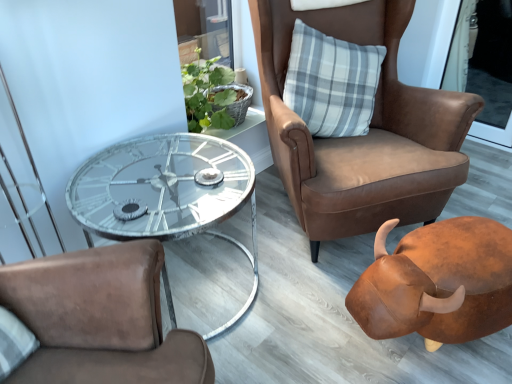
Question: In the image, is brown leather chair at upper right positioned in front of or behind gray plaid pillow at upper right?

Choices:
 (A) behind
 (B) front

Answer: (B)

Question: Is brown leather chair at upper right inside the boundaries of gray plaid pillow at upper right, or outside?

Choices:
 (A) inside
 (B) outside

Answer: (B)

Question: Which object is the farthest from the metallic glass coffee table at center?

Choices:
 (A) transparent plastic screen door at upper right
 (B) brown leather piggy bank at lower right
 (C) brown leather chair at upper right
 (D) gray plaid pillow at upper right

Answer: (A)

Question: Which object is the closest to the brown leather chair at upper right?

Choices:
 (A) brown leather piggy bank at lower right
 (B) gray plaid pillow at upper right
 (C) transparent plastic screen door at upper right
 (D) metallic glass coffee table at center

Answer: (B)